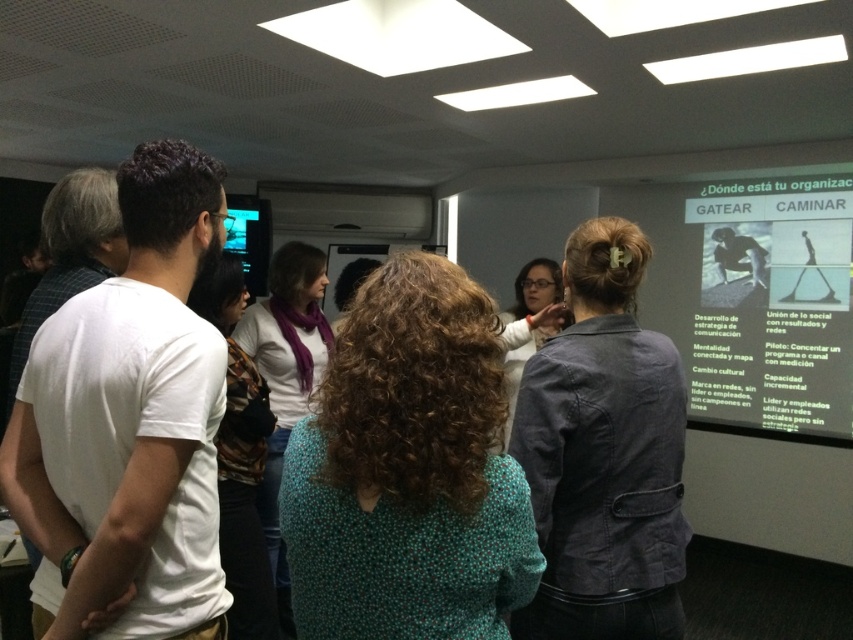
Question: Estimate the real-world distances between objects in this image. Which object is farther from the green printed shirt at center?

Choices:
 (A) white cotton t-shirt at left
 (B) dark gray denim jacket at center
 (C) white glossy projection screen at upper center

Answer: (C)

Question: Is white cotton t-shirt at left bigger than dark gray denim jacket at center?

Choices:
 (A) no
 (B) yes

Answer: (A)

Question: Does white glossy projection screen at upper center appear on the left side of matte black screen at upper left?

Choices:
 (A) no
 (B) yes

Answer: (A)

Question: Where is dark gray denim jacket at center located in relation to matte black screen at upper left in the image?

Choices:
 (A) left
 (B) right

Answer: (B)

Question: Which object is the farthest from the green printed shirt at center?

Choices:
 (A) matte black screen at upper left
 (B) matte white shirt at center
 (C) white glossy projection screen at upper center

Answer: (A)

Question: Estimate the real-world distances between objects in this image. Which object is farther from the matte black screen at upper left?

Choices:
 (A) white cotton t-shirt at left
 (B) green printed shirt at center

Answer: (B)